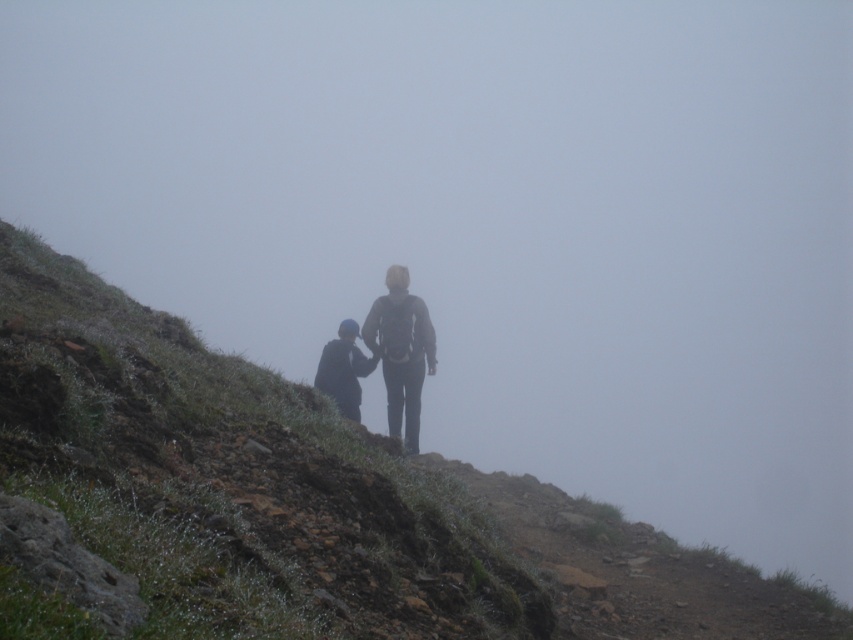
Find the location of a particular element. The image size is (853, 640). dull brown dirt at center is located at coordinates point(312,499).

I want to click on dull brown dirt at center, so click(x=312, y=499).

Is point (396, 397) positioned before point (312, 380)?

Yes.

Locate an element on the screen. The width and height of the screenshot is (853, 640). dark gray fabric jacket at center is located at coordinates (383, 356).

The width and height of the screenshot is (853, 640). Find the location of `dark gray fabric jacket at center`. dark gray fabric jacket at center is located at coordinates (383, 356).

Who is positioned more to the right, dull brown dirt at center or dark blue fabric jacket at center?

dark blue fabric jacket at center is more to the right.

What do you see at coordinates (312, 499) in the screenshot? I see `dull brown dirt at center` at bounding box center [312, 499].

Locate an element on the screen. dull brown dirt at center is located at coordinates (312, 499).